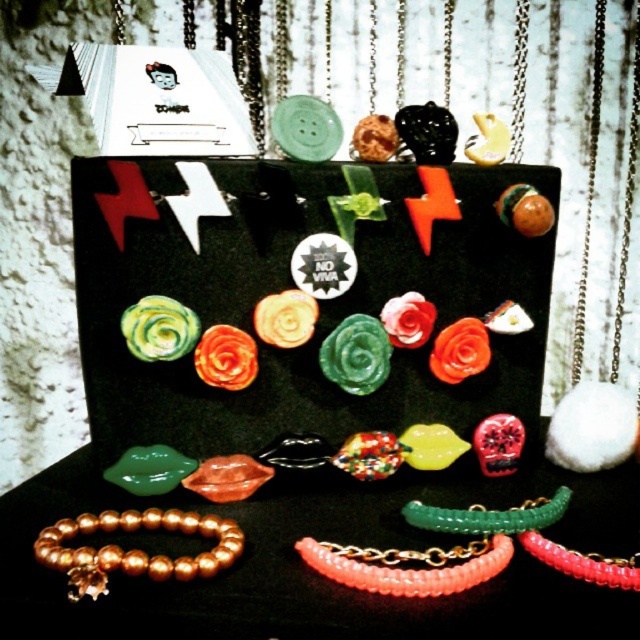
You are organizing a jewelry display and need to place the gold pearl bracelet at lower left and the green glass bracelet at center. According to the scene description, where should you position them relative to each other?

The gold pearl bracelet at lower left should be positioned below the green glass bracelet at center, as stated in the objects description.

You are a customer examining the jewelry display. You notice the pink beaded bracelet at center and the translucent coral beads at lower right. Which of these two items is positioned closer to you?

The pink beaded bracelet at center is closer to the viewer than the translucent coral beads at lower right.

You are a customer looking to buy a bracelet and see the gold pearl bracelet at lower left and the pink beaded bracelet at center in the display. Which bracelet is positioned higher in the display?

The gold pearl bracelet at lower left is located above the pink beaded bracelet at center, so it is positioned higher in the display.